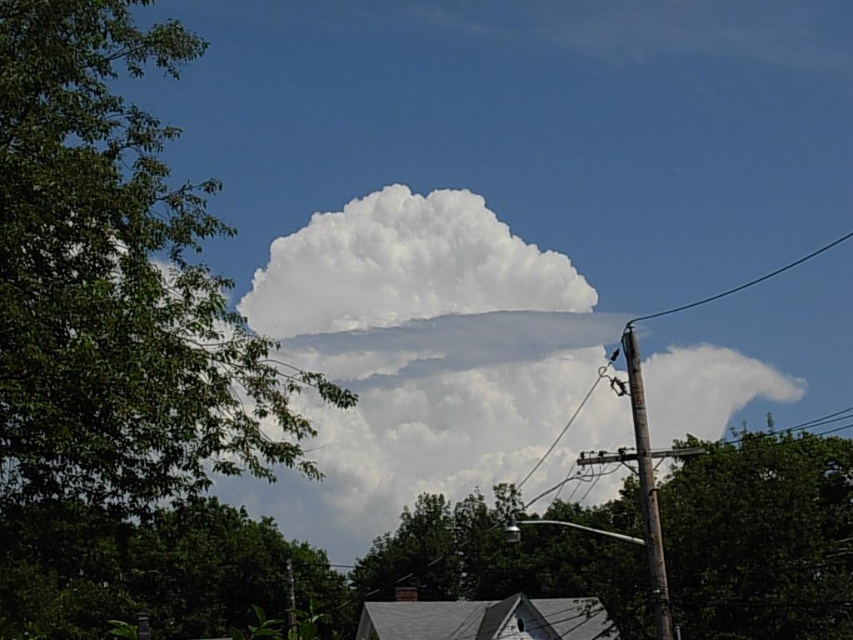
Question: Which object appears closest to the camera in this image?

Choices:
 (A) green leafy tree at lower left
 (B) green leafy tree at center
 (C) wooden telephone pole at right

Answer: (A)

Question: Is white fluffy cloud at upper center below wooden telephone pole at right?

Choices:
 (A) yes
 (B) no

Answer: (B)

Question: Estimate the real-world distances between objects in this image. Which object is farther from the green leafy tree at lower left?

Choices:
 (A) black wire at upper right
 (B) green leafy tree at center
 (C) white fluffy cloud at upper center

Answer: (A)

Question: Is green leafy tree at center to the right of wooden telephone pole at right from the viewer's perspective?

Choices:
 (A) yes
 (B) no

Answer: (A)

Question: Which object is closer to the camera taking this photo?

Choices:
 (A) green leafy tree at lower left
 (B) white fluffy cloud at upper center
 (C) green leafy tree at center
 (D) wooden telephone pole at right

Answer: (A)

Question: Observing the image, what is the correct spatial positioning of white fluffy cloud at upper center in reference to wooden telephone pole at right?

Choices:
 (A) above
 (B) below

Answer: (A)